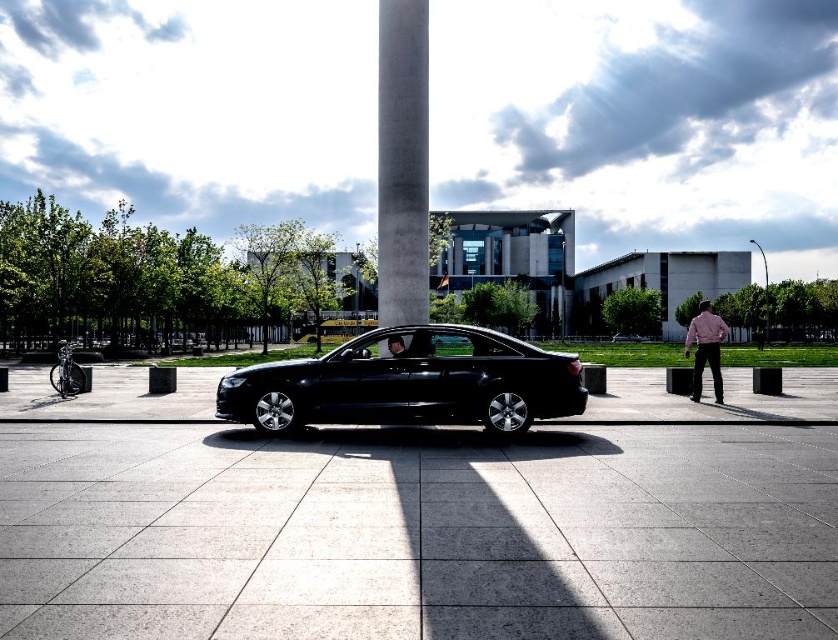
Is point (392, 296) farther from camera compared to point (394, 342)?

Yes.

Between point (381, 260) and point (389, 339), which one is positioned behind?

The point (381, 260) is more distant.

Find the location of a particular element. concrete column at center is located at coordinates (402, 161).

Is pink shirt at right further to the viewer compared to shiny black sedan at center?

No, it is in front of shiny black sedan at center.

The image size is (838, 640). Describe the element at coordinates (705, 349) in the screenshot. I see `pink shirt at right` at that location.

At what (x,y) coordinates should I click in order to perform the action: click on pink shirt at right. Please return your answer as a coordinate pair (x, y). Looking at the image, I should click on (705, 349).

Who is taller, black metallic car at center or concrete column at center?

With more height is concrete column at center.

Looking at this image, can you confirm if black metallic car at center is smaller than concrete column at center?

Yes, black metallic car at center is smaller than concrete column at center.

Where is `black metallic car at center`? The width and height of the screenshot is (838, 640). black metallic car at center is located at coordinates (409, 384).